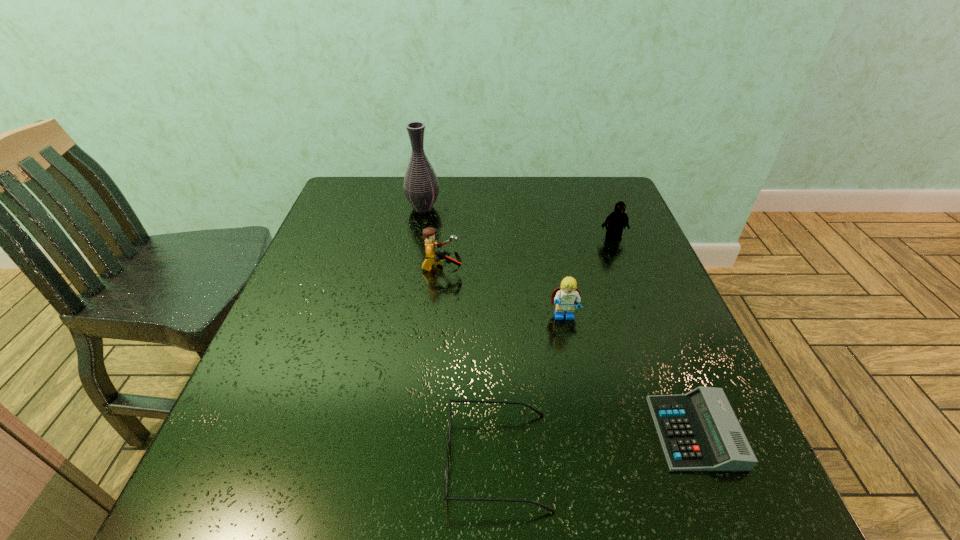
Find the location of a particular element. The image size is (960, 540). vacant space that's between the fifth tallest object and the third nearest object is located at coordinates (531, 389).

In order to click on free area in between the spectacles and the second nearest Lego in this screenshot , I will do `click(470, 364)`.

Locate an element on the screen. This screenshot has width=960, height=540. blank region between the fourth nearest object and the second Lego from right to left is located at coordinates (503, 293).

The width and height of the screenshot is (960, 540). I want to click on vacant point located between the farthest Lego and the spectacles, so click(x=556, y=349).

The height and width of the screenshot is (540, 960). Find the location of `free space that is in between the spectacles and the second nearest Lego`. free space that is in between the spectacles and the second nearest Lego is located at coordinates (470, 364).

At what (x,y) coordinates should I click in order to perform the action: click on vacant space that is in between the second Lego from right to left and the calculator. Please return your answer as a coordinate pair (x, y). The height and width of the screenshot is (540, 960). Looking at the image, I should click on (630, 375).

I want to click on free spot between the fourth nearest object and the farthest Lego, so click(x=528, y=253).

Select which object appears as the second closest to the fifth tallest object. Please provide its 2D coordinates. Your answer should be formatted as a tuple, i.e. [(x, y)], where the tuple contains the x and y coordinates of a point satisfying the conditions above.

[(566, 297)]

Where is `object that stands as the closest to the second Lego from left to right`? This screenshot has width=960, height=540. object that stands as the closest to the second Lego from left to right is located at coordinates (699, 431).

Select which Lego is the second closest to the rightmost Lego. Please provide its 2D coordinates. Your answer should be formatted as a tuple, i.e. [(x, y)], where the tuple contains the x and y coordinates of a point satisfying the conditions above.

[(432, 257)]